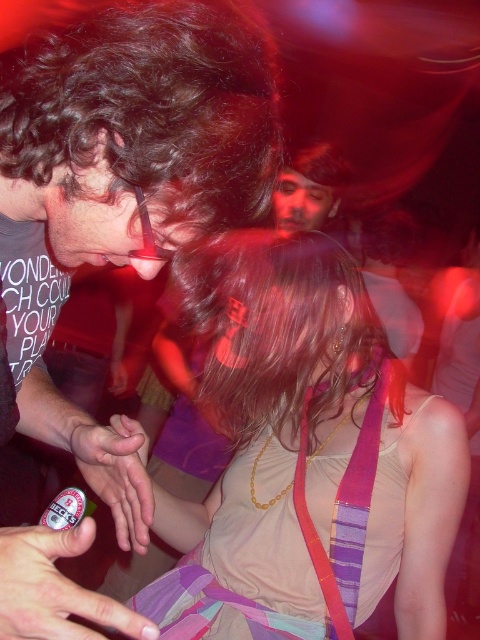
Question: Which point appears closest to the camera in this image?

Choices:
 (A) coord(20,237)
 (B) coord(25,563)

Answer: (B)

Question: Considering the relative positions of purple striped strap at center and matte skin hand at center in the image provided, where is purple striped strap at center located with respect to matte skin hand at center?

Choices:
 (A) below
 (B) above

Answer: (A)

Question: Is brown shiny hair at center further to camera compared to purple striped strap at center?

Choices:
 (A) yes
 (B) no

Answer: (B)

Question: Which point appears farthest from the camera in this image?

Choices:
 (A) (211, 540)
 (B) (128, 432)
 (C) (363, 509)

Answer: (A)

Question: Which point is farther from the camera taking this photo?

Choices:
 (A) (55, 580)
 (B) (344, 500)
 (C) (126, 465)
 (D) (245, 257)

Answer: (B)

Question: Is matte black shirt at center wider than matte skin hand at center?

Choices:
 (A) no
 (B) yes

Answer: (B)